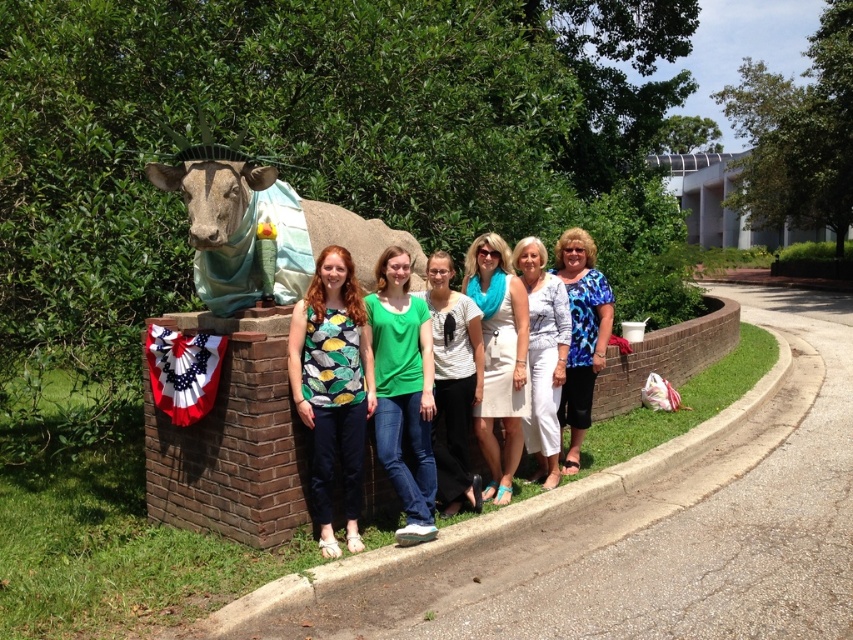
Is point (413, 538) behind point (526, 436)?

No, (413, 538) is in front of (526, 436).

The width and height of the screenshot is (853, 640). What do you see at coordinates (403, 390) in the screenshot?
I see `green cotton shirt at center` at bounding box center [403, 390].

Who is more forward, (412, 420) or (531, 378)?

Positioned in front is point (412, 420).

The width and height of the screenshot is (853, 640). I want to click on green cotton shirt at center, so click(403, 390).

In the scene shown: How distant is white fabric skirt at center from blue printed blouse at center?

They are 68.45 centimeters apart.

Between white fabric skirt at center and blue printed blouse at center, which one appears on the right side from the viewer's perspective?

From the viewer's perspective, blue printed blouse at center appears more on the right side.

The width and height of the screenshot is (853, 640). What are the coordinates of `white fabric skirt at center` in the screenshot? It's located at (498, 356).

Between point (346, 464) and point (494, 385), which one is positioned behind?

Positioned behind is point (494, 385).

Can you confirm if printed fabric blouse at center is bigger than white fabric skirt at center?

Incorrect, printed fabric blouse at center is not larger than white fabric skirt at center.

In order to click on printed fabric blouse at center in this screenshot , I will do `click(332, 387)`.